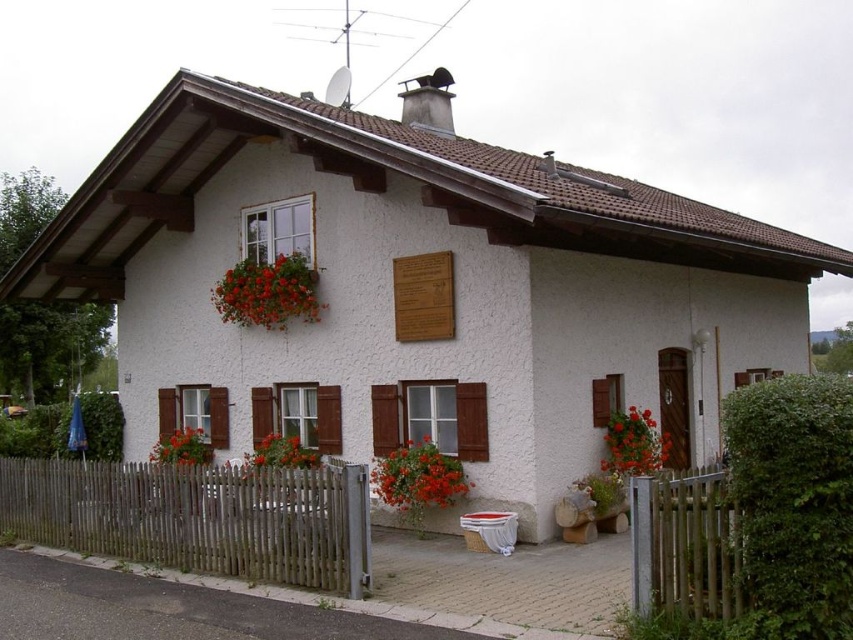
Can you confirm if vibrant red petals at center is taller than vivid red petals at center?

Yes.

In the scene shown: Can you confirm if vibrant red petals at center is positioned to the right of vivid red petals at center?

Correct, you'll find vibrant red petals at center to the right of vivid red petals at center.

You are a GUI agent. You are given a task and a screenshot of the screen. Output one action in this format:
    pyautogui.click(x=<x>, y=<y>)
    Task: Click on the vibrant red petals at center
    
    Given the screenshot: What is the action you would take?
    pyautogui.click(x=418, y=476)

Does point (109, 536) come in front of point (259, 275)?

Yes, point (109, 536) is in front of point (259, 275).

Based on the photo, does brown wooden fence at lower left appear over floral fabric basket at upper left?

Incorrect, brown wooden fence at lower left is not positioned above floral fabric basket at upper left.

At what (x,y) coordinates should I click in order to perform the action: click on brown wooden fence at lower left. Please return your answer as a coordinate pair (x, y). Image resolution: width=853 pixels, height=640 pixels. Looking at the image, I should click on (198, 516).

Locate an element on the screen. This screenshot has width=853, height=640. brown wooden fence at lower left is located at coordinates (198, 516).

Between white fabric flower box at lower center and bright red flowers at lower left, which one appears on the left side from the viewer's perspective?

bright red flowers at lower left

This screenshot has height=640, width=853. What do you see at coordinates (489, 531) in the screenshot?
I see `white fabric flower box at lower center` at bounding box center [489, 531].

Which is behind, point (466, 520) or point (175, 456)?

The point (175, 456) is more distant.

I want to click on white fabric flower box at lower center, so click(489, 531).